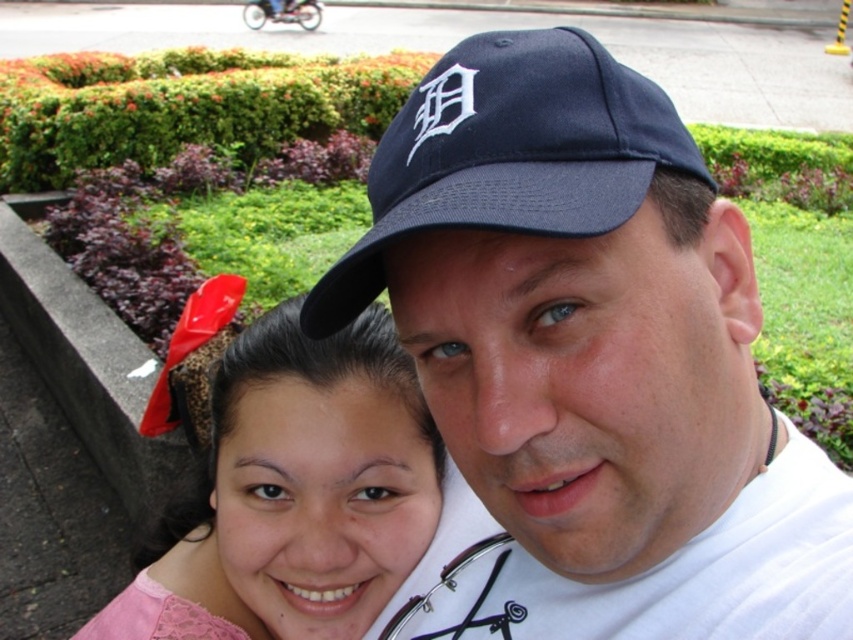
Between pink lace hairband at upper left and navy blue fabric baseball cap at center, which one is positioned lower?

pink lace hairband at upper left

Is pink lace hairband at upper left bigger than navy blue fabric baseball cap at center?

Correct, pink lace hairband at upper left is larger in size than navy blue fabric baseball cap at center.

Is point (366, 582) behind point (576, 236)?

That is True.

Where is `pink lace hairband at upper left`? pink lace hairband at upper left is located at coordinates (300, 486).

Which is more to the left, navy blue baseball cap at upper center or pink lace hairband at upper left?

From the viewer's perspective, pink lace hairband at upper left appears more on the left side.

Is navy blue baseball cap at upper center positioned in front of pink lace hairband at upper left?

Yes, navy blue baseball cap at upper center is in front of pink lace hairband at upper left.

Locate an element on the screen. The height and width of the screenshot is (640, 853). navy blue baseball cap at upper center is located at coordinates (590, 358).

Is navy blue baseball cap at upper center to the right of navy blue fabric baseball cap at center from the viewer's perspective?

Correct, you'll find navy blue baseball cap at upper center to the right of navy blue fabric baseball cap at center.

Does navy blue baseball cap at upper center have a greater width compared to navy blue fabric baseball cap at center?

Indeed, navy blue baseball cap at upper center has a greater width compared to navy blue fabric baseball cap at center.

Is point (827, 636) positioned before point (651, 145)?

No, it is behind (651, 145).

You are a GUI agent. You are given a task and a screenshot of the screen. Output one action in this format:
    pyautogui.click(x=<x>, y=<y>)
    Task: Click on the navy blue baseball cap at upper center
    This screenshot has width=853, height=640.
    Given the screenshot: What is the action you would take?
    pyautogui.click(x=590, y=358)